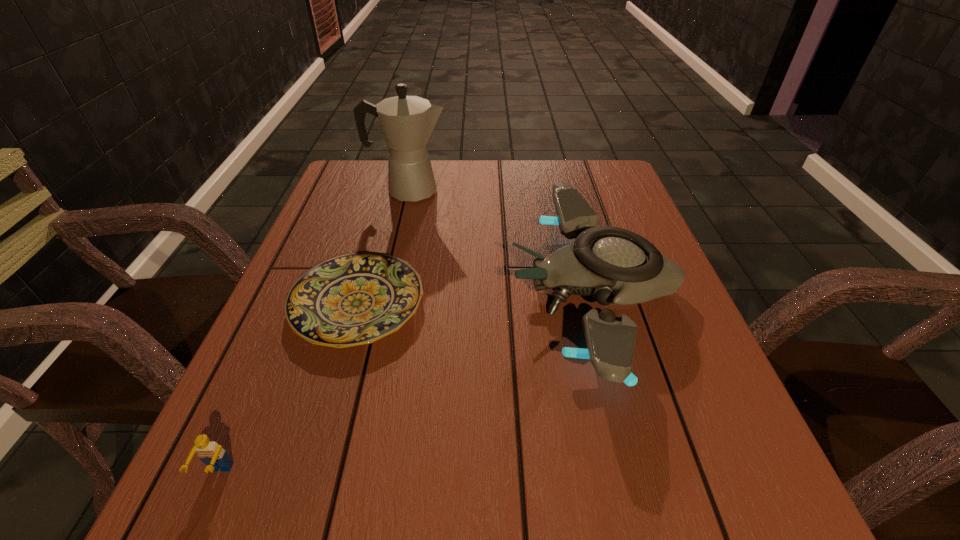
You are a GUI agent. You are given a task and a screenshot of the screen. Output one action in this format:
    pyautogui.click(x=<x>, y=<y>)
    Task: Click on the free space in the image that satisfies the following two spatial constraints: 1. on the front-facing side of the third shortest object; 2. on the front side of the plate
    
    Given the screenshot: What is the action you would take?
    pyautogui.click(x=598, y=304)